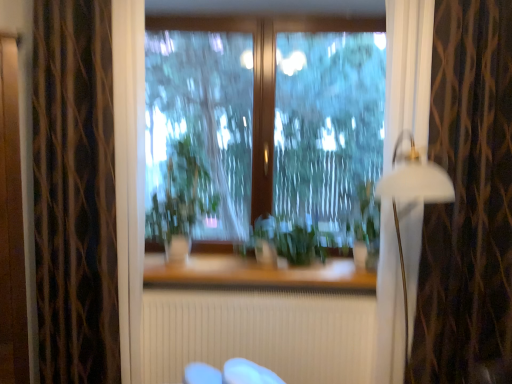
Question: From a real-world perspective, is white matte lamp at right positioned above or below transparent glass window at center?

Choices:
 (A) below
 (B) above

Answer: (A)

Question: Is white matte lamp at right bigger or smaller than transparent glass window at center?

Choices:
 (A) big
 (B) small

Answer: (B)

Question: Which of these objects is positioned farthest from the green leafy plant at center, acting as the first plant starting from the left?

Choices:
 (A) brown textured curtain at right, the 1th curtain when ordered from right to left
 (B) white matte lamp at right
 (C) transparent glass window at center
 (D) white textured radiator at center
 (E) green matte plant at center, placed as the second plant when sorted from left to right

Answer: (A)

Question: Estimate the real-world distances between objects in this image. Which object is closer to the transparent glass window at center?

Choices:
 (A) green leafy plant at center, acting as the first plant starting from the left
 (B) white textured radiator at center
 (C) white matte lamp at right
 (D) dark brown textured curtain at left, the first curtain from the left
 (E) green matte plant at center, placed as the second plant when sorted from left to right

Answer: (E)